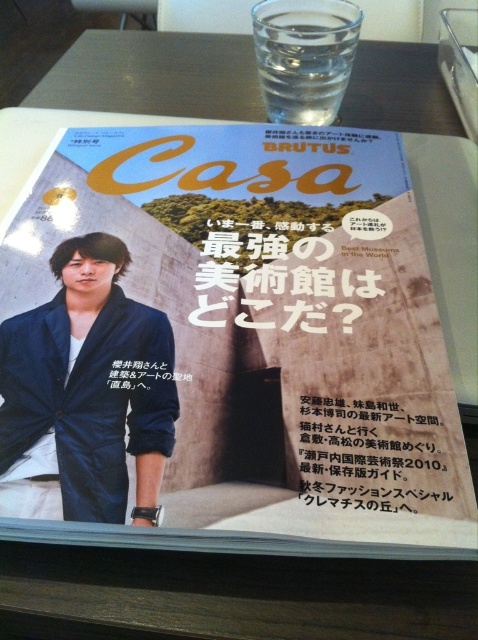
Please describe the object located at the coordinates point (265, 332) in the image of the magazine cover.

The object at point (265, 332) is the blue fabric magazine at center.

You are organizing a display table and have a blue fabric magazine at center and a black paper at center. If you want to place both items side by side without overlapping, which item should be placed first to ensure they both fit on the table?

The blue fabric magazine at center has a larger width than the black paper at center, so you should place the blue fabric magazine at center first to ensure there is enough space for both items on the table.

You are organizing a display at an art museum and need to place the blue fabric magazine at center and the satin blue blazer at left. According to the image, which item is covering the other?

The blue fabric magazine at center is positioned over the satin blue blazer at left, so it is covering the blazer.